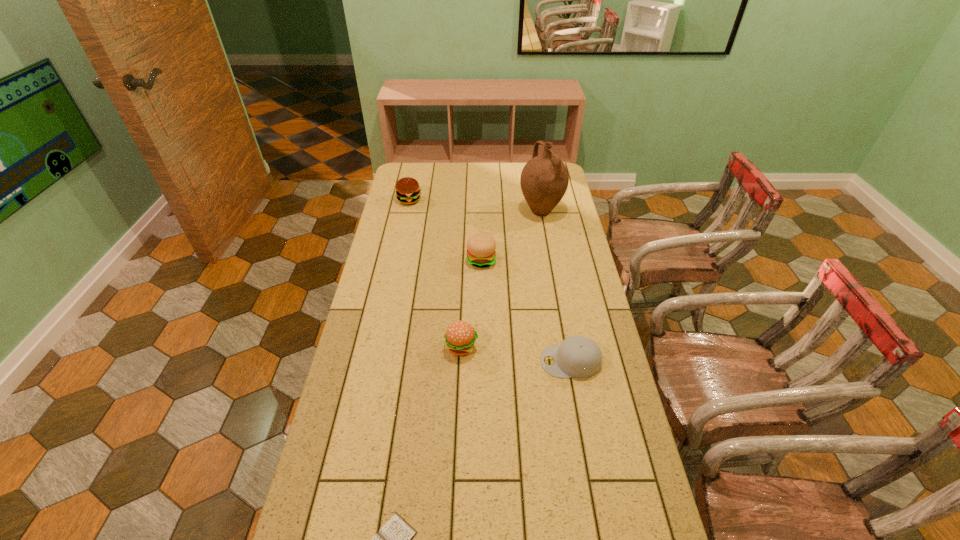
The image size is (960, 540). I want to click on vacant space that's between the second shortest object and the pitcher, so click(x=556, y=286).

Image resolution: width=960 pixels, height=540 pixels. Identify the location of vacant space in between the second shortest object and the tallest object. (x=556, y=286).

Where is `empty location between the pitcher and the fifth tallest object`? This screenshot has width=960, height=540. empty location between the pitcher and the fifth tallest object is located at coordinates (556, 286).

Find the location of a particular element. object identified as the closest to the cap is located at coordinates (460, 336).

The image size is (960, 540). What are the coordinates of `object that is the fifth nearest to the cap` in the screenshot? It's located at (408, 192).

At what (x,y) coordinates should I click in order to perform the action: click on the closest hamburger to the nearest hamburger. Please return your answer as a coordinate pair (x, y). This screenshot has height=540, width=960. Looking at the image, I should click on (481, 247).

The height and width of the screenshot is (540, 960). Identify the location of hamburger that can be found as the second closest to the third farthest object. point(408,192).